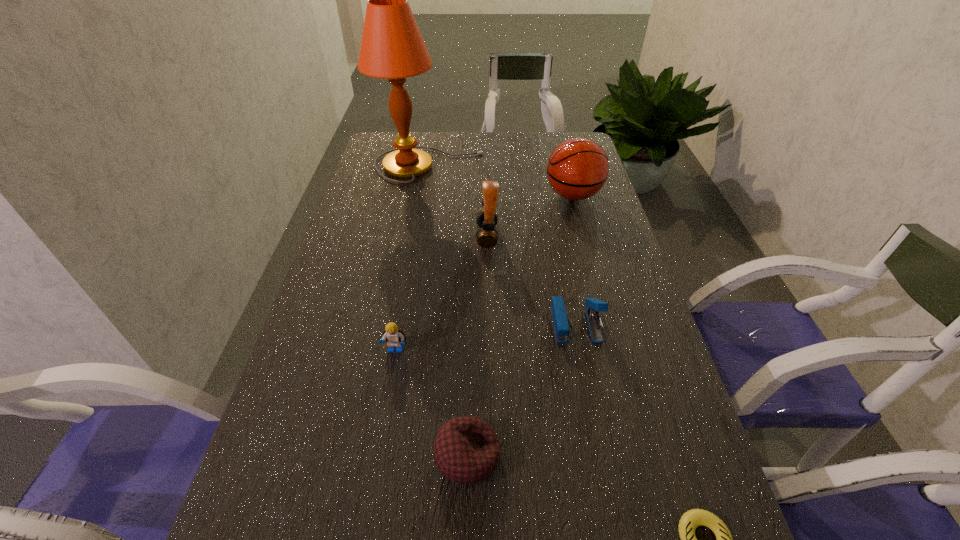
This screenshot has height=540, width=960. I want to click on lamp, so click(392, 47).

This screenshot has width=960, height=540. I want to click on basketball, so click(x=577, y=169).

Where is `the third farthest object`? Image resolution: width=960 pixels, height=540 pixels. the third farthest object is located at coordinates (487, 237).

The image size is (960, 540). I want to click on stapler, so click(593, 306).

At what (x,y) coordinates should I click in order to perform the action: click on Lego. Please return your answer as a coordinate pair (x, y). The image size is (960, 540). Looking at the image, I should click on (394, 337).

Identify the location of beanbag. Image resolution: width=960 pixels, height=540 pixels. (466, 449).

What are the coordinates of `the sixth farthest object` in the screenshot? It's located at (466, 449).

Where is `vacant space located on the front of the lamp`? Image resolution: width=960 pixels, height=540 pixels. vacant space located on the front of the lamp is located at coordinates (415, 260).

The height and width of the screenshot is (540, 960). Find the location of `vacant space situated 0.090m on the side with spill of the basketball`. vacant space situated 0.090m on the side with spill of the basketball is located at coordinates (516, 195).

At what (x,y) coordinates should I click in order to perform the action: click on vacant space positioned 0.080m on the side with spill of the basketball. Please return your answer as a coordinate pair (x, y). The width and height of the screenshot is (960, 540). Looking at the image, I should click on point(519,195).